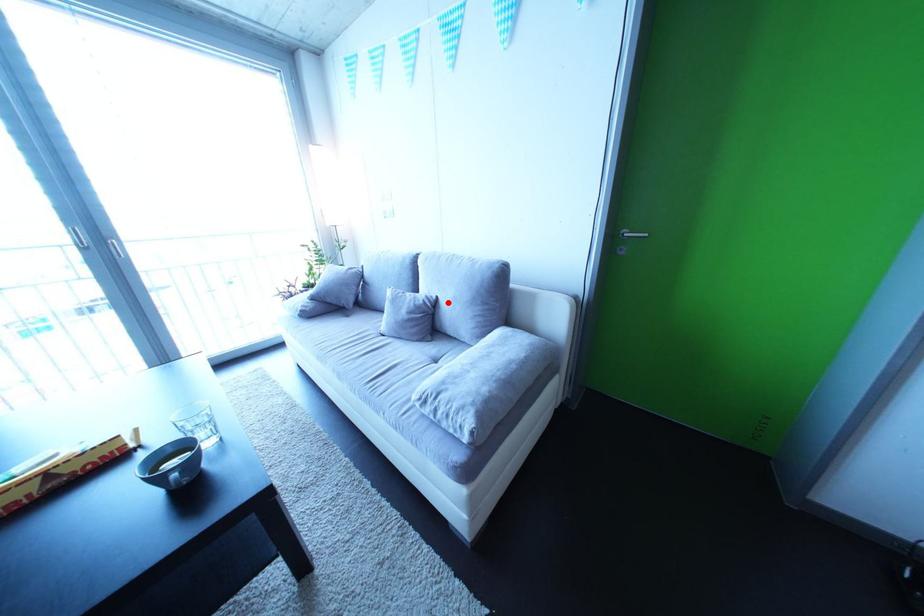
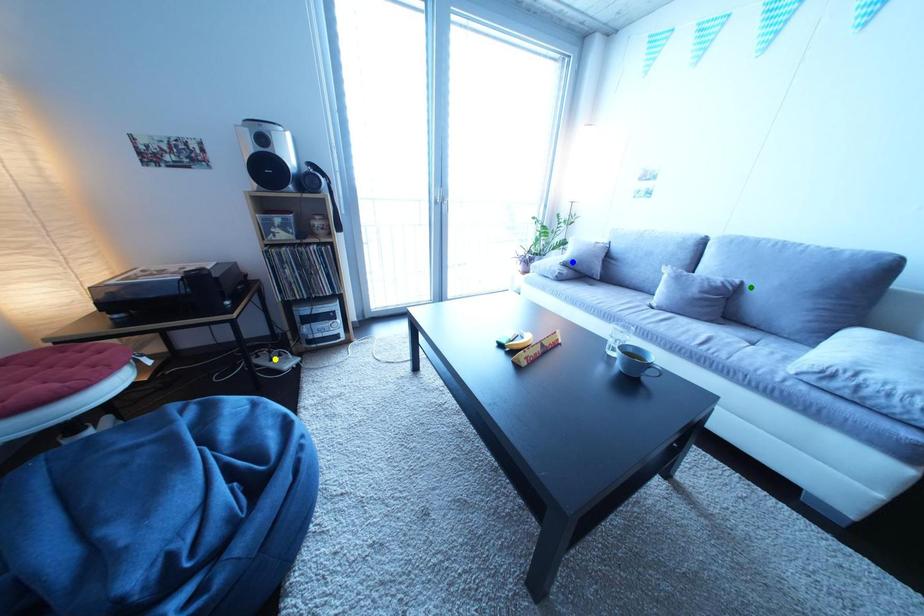
Question: I am providing you with two images of the same scene from different viewpoints. A red point is marked on the first image. You are given multiple points on the second image. Which mark in image 2 goes with the point in image 1?

Choices:
 (A) green point
 (B) blue point
 (C) yellow point

Answer: (A)